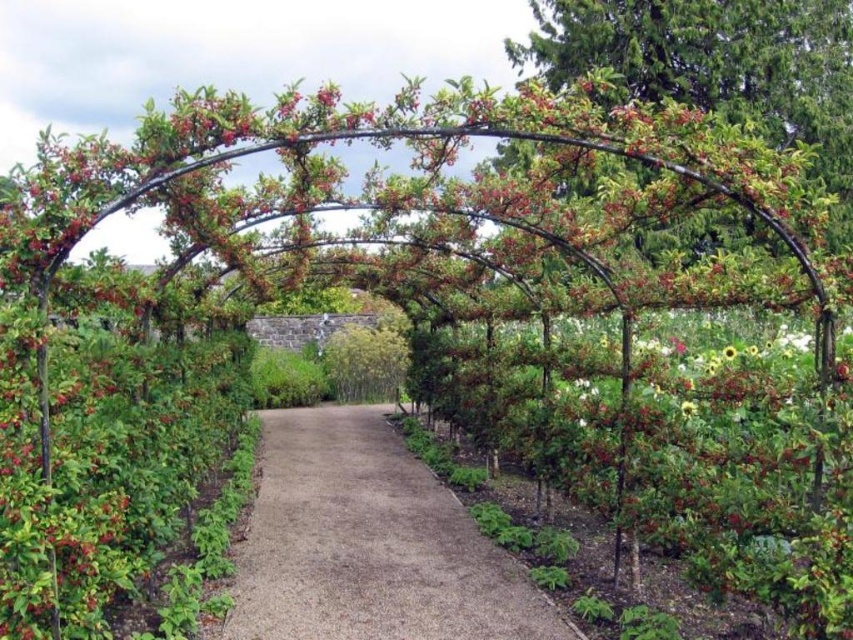
You are standing at the entrance of the garden pathway and see two points marked on the path. The first point is at coordinate point (402, 621) and the second is at point (346, 340). Which point is closer to you as you face the pathway?

Point (402, 621) is in front of point (346, 340), so the first point is closer to you.